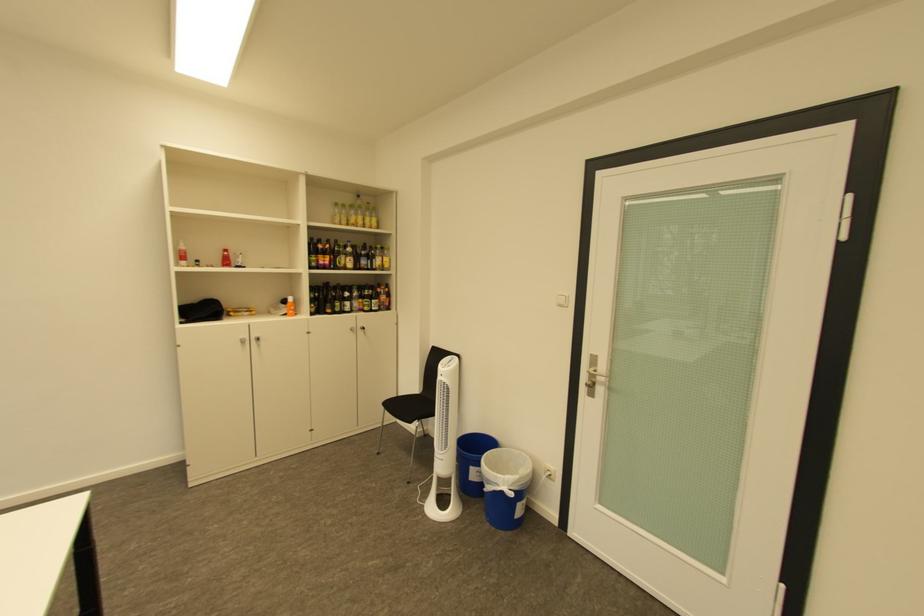
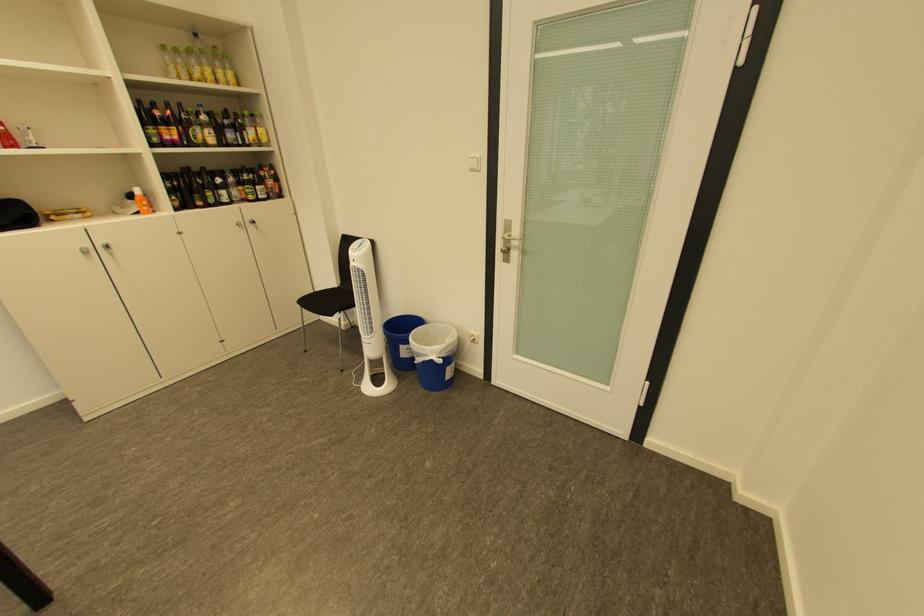
The point at (378, 220) is marked in the first image. Where is the corresponding point in the second image?

(228, 73)